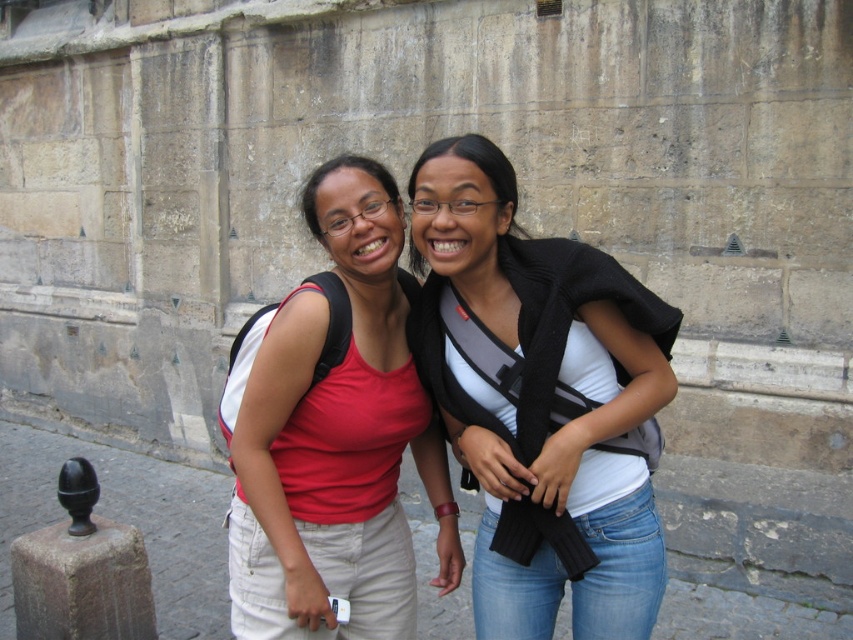
Is point (486, 426) farther from viewer compared to point (483, 172)?

That is True.

This screenshot has width=853, height=640. Describe the element at coordinates (541, 401) in the screenshot. I see `matte black sweater at center` at that location.

Image resolution: width=853 pixels, height=640 pixels. I want to click on matte black sweater at center, so pyautogui.click(x=541, y=401).

Between matte black sweater at center and matte red tank top at center, which one is positioned higher?

Positioned higher is matte black sweater at center.

Consider the image. Who is positioned more to the right, matte black sweater at center or matte red tank top at center?

matte black sweater at center

Does point (595, 561) come closer to viewer compared to point (384, 316)?

Yes, it is.

Where is `matte black sweater at center`? Image resolution: width=853 pixels, height=640 pixels. matte black sweater at center is located at coordinates tap(541, 401).

Which of these two, matte black sweater at center or dark brown stone post at lower left, stands taller?

matte black sweater at center

At what (x,y) coordinates should I click in order to perform the action: click on matte black sweater at center. Please return your answer as a coordinate pair (x, y). The width and height of the screenshot is (853, 640). Looking at the image, I should click on (541, 401).

Which is behind, point (582, 552) or point (142, 561)?

The point (142, 561) is more distant.

At what (x,y) coordinates should I click in order to perform the action: click on matte black sweater at center. Please return your answer as a coordinate pair (x, y). The width and height of the screenshot is (853, 640). Looking at the image, I should click on (541, 401).